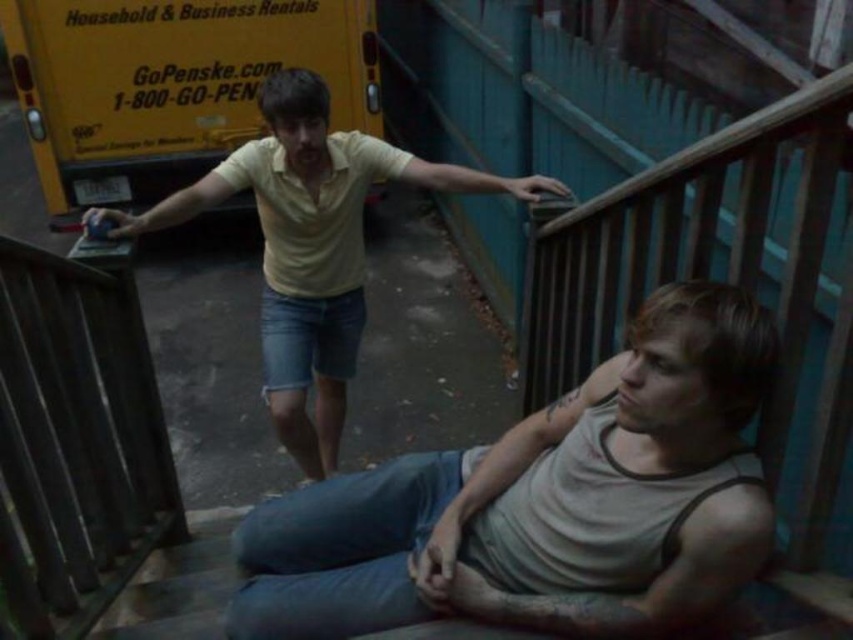
You are a delivery person trying to navigate through the staircase. You notice the gray cotton tank top at lower right and the wooden balustrade at lower left. Which object is wider in this scene?

The gray cotton tank top at lower right is wider than the wooden balustrade at lower left.

You are a delivery person trying to navigate the stairs in the dark. You see the gray cotton tank top at lower right and the wooden balustrade at lower left. Which object should you grab to ensure a stable grip while climbing?

You should grab the wooden balustrade at lower left because the gray cotton tank top at lower right is closer to you, but the tank top is clothing and not a sturdy grip point. The balustrade is a fixed structure designed for support.